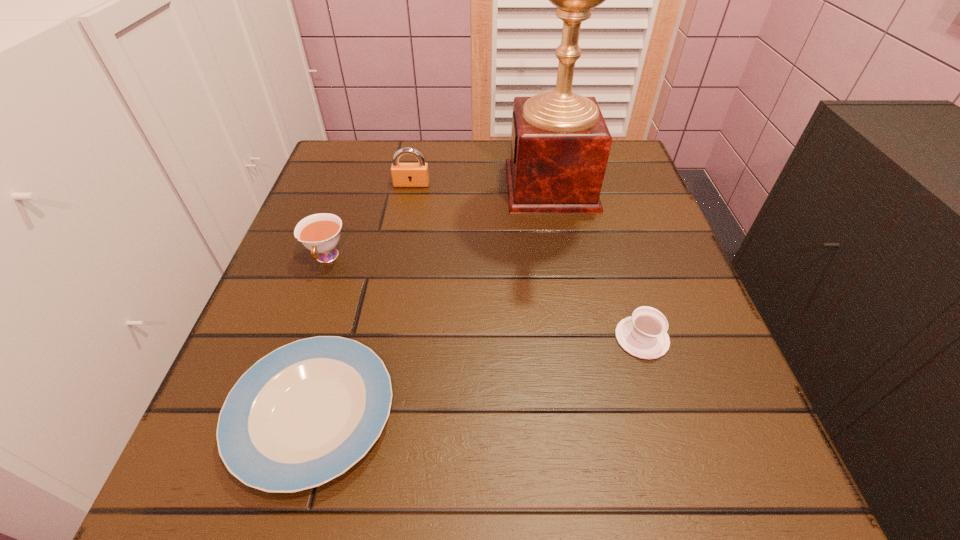
Image resolution: width=960 pixels, height=540 pixels. In order to click on plate present at the left edge in this screenshot , I will do `click(304, 414)`.

Locate an element on the screen. Image resolution: width=960 pixels, height=540 pixels. trophy cup that is at the right edge is located at coordinates (560, 143).

Image resolution: width=960 pixels, height=540 pixels. Find the location of `teacup present at the right edge`. teacup present at the right edge is located at coordinates (644, 335).

The image size is (960, 540). What are the coordinates of `object present at the near left corner` in the screenshot? It's located at (304, 414).

The width and height of the screenshot is (960, 540). What are the coordinates of `object that is at the far right corner` in the screenshot? It's located at (560, 143).

This screenshot has width=960, height=540. In the image, there is a desktop. Identify the location of free space at the far edge. (497, 139).

The height and width of the screenshot is (540, 960). In order to click on vacant position at the left edge of the desktop in this screenshot , I will do `click(350, 278)`.

Where is `free space at the right edge of the desktop`? free space at the right edge of the desktop is located at coordinates (666, 248).

Where is `vacant area at the far left corner of the desktop`? The height and width of the screenshot is (540, 960). vacant area at the far left corner of the desktop is located at coordinates (366, 179).

In the image, there is a desktop. Where is `vacant space at the far right corner`? This screenshot has width=960, height=540. vacant space at the far right corner is located at coordinates (637, 164).